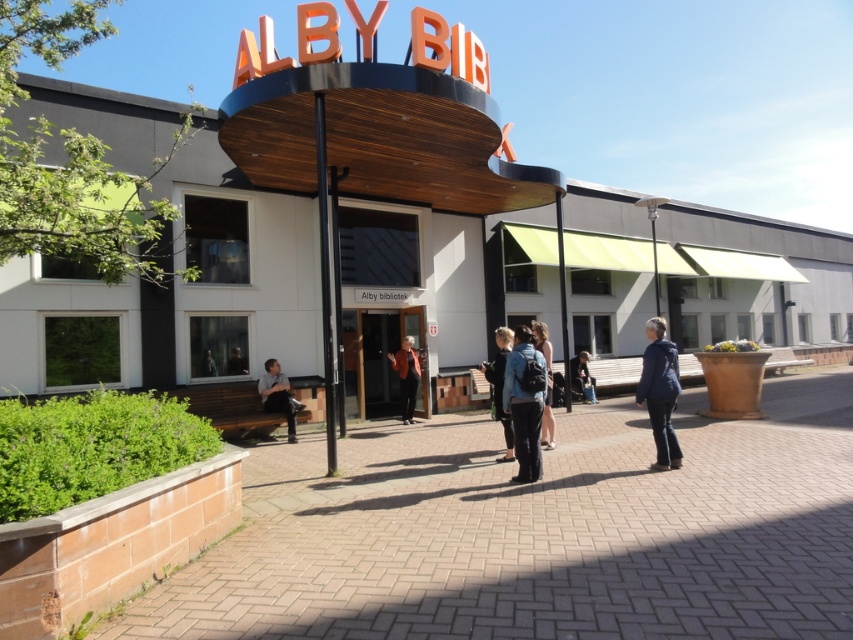
Question: Can you confirm if dark blue jacket at center is bigger than dark blue jeans at lower center?

Choices:
 (A) yes
 (B) no

Answer: (B)

Question: Does denim jacket at center appear on the right side of dark blue jeans at lower left?

Choices:
 (A) yes
 (B) no

Answer: (A)

Question: Which of the following is the closest to the observer?

Choices:
 (A) brick pavement at lower left
 (B) denim jacket at center

Answer: (A)

Question: Estimate the real-world distances between objects in this image. Which object is farther from the light brown leather jacket at center?

Choices:
 (A) orange leather jacket at center
 (B) wooden sign at upper center
 (C) dark blue jeans at lower left
 (D) dark blue jacket at center

Answer: (B)

Question: Among these points, which one is nearest to the camera?

Choices:
 (A) (271, 388)
 (B) (589, 394)
 (C) (538, 333)

Answer: (C)

Question: Can you confirm if brick pavement at lower left is positioned to the left of light brown leather jacket at center?

Choices:
 (A) yes
 (B) no

Answer: (B)